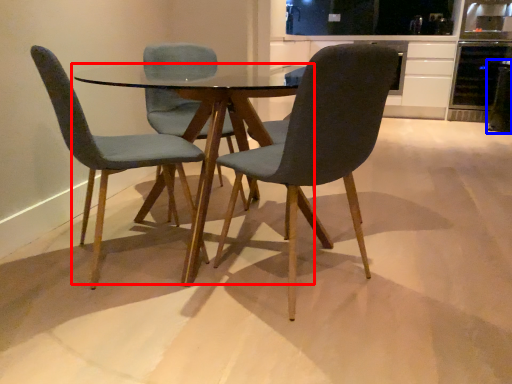
Question: Among these objects, which one is farthest to the camera, coffee table (highlighted by a red box) or appliance (highlighted by a blue box)?

Choices:
 (A) coffee table
 (B) appliance

Answer: (B)